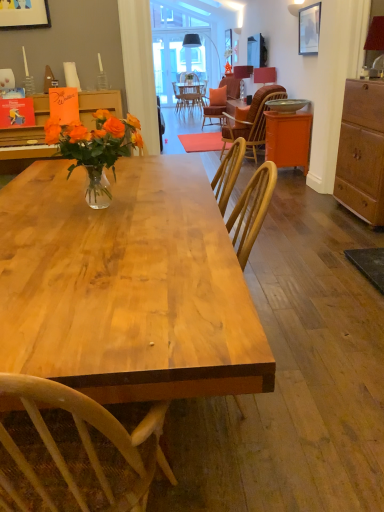
Question: Is matte red lampshade at upper right, which is the second lamp from right to left, outside of matte red lampshade at upper right, the first lamp positioned from the front?

Choices:
 (A) yes
 (B) no

Answer: (A)

Question: From the image's perspective, is matte red lampshade at upper right, placed as the 2th lamp when sorted from left to right, on top of matte red lampshade at upper right, the first lamp positioned from the front?

Choices:
 (A) yes
 (B) no

Answer: (A)

Question: Can you confirm if matte red lampshade at upper right, which is the 2th lamp from top to bottom, is positioned to the left of matte red lampshade at upper right, the first lamp positioned from the front?

Choices:
 (A) no
 (B) yes

Answer: (B)

Question: From a real-world perspective, is matte red lampshade at upper right, which is the 2th lamp from back to front, beneath matte red lampshade at upper right, the 3th lamp positioned from the back?

Choices:
 (A) yes
 (B) no

Answer: (A)

Question: From the image's perspective, is matte red lampshade at upper right, which is the 2th lamp from top to bottom, located beneath matte red lampshade at upper right, the 3th lamp viewed from the top?

Choices:
 (A) no
 (B) yes

Answer: (A)

Question: Considering the positions of matte black picture frame at upper right and wooden cabinet at right in the image, is matte black picture frame at upper right taller or shorter than wooden cabinet at right?

Choices:
 (A) tall
 (B) short

Answer: (B)

Question: Looking at the image, does matte black picture frame at upper right seem bigger or smaller compared to wooden cabinet at right?

Choices:
 (A) small
 (B) big

Answer: (A)

Question: Which is correct: matte black picture frame at upper right is inside wooden cabinet at right, or outside of it?

Choices:
 (A) outside
 (B) inside

Answer: (A)

Question: From the image's perspective, is matte black picture frame at upper right positioned above or below wooden cabinet at right?

Choices:
 (A) below
 (B) above

Answer: (B)

Question: Looking at the image, does wooden wicker chair at center seem bigger or smaller compared to orange matte cabinet at right?

Choices:
 (A) small
 (B) big

Answer: (B)

Question: In terms of width, does wooden wicker chair at center look wider or thinner when compared to orange matte cabinet at right?

Choices:
 (A) wide
 (B) thin

Answer: (A)

Question: From a real-world perspective, is wooden wicker chair at center positioned above or below orange matte cabinet at right?

Choices:
 (A) above
 (B) below

Answer: (A)

Question: From their relative heights in the image, would you say wooden wicker chair at center is taller or shorter than orange matte cabinet at right?

Choices:
 (A) short
 (B) tall

Answer: (B)

Question: From the image's perspective, relative to matte red lampshade at upper right, which is the 2th lamp from top to bottom, is matte red lampshade at upper right, the 1th lamp when ordered from bottom to top, above or below?

Choices:
 (A) below
 (B) above

Answer: (A)

Question: Is point 372,34 positioned closer to the camera than point 264,78?

Choices:
 (A) closer
 (B) farther

Answer: (A)